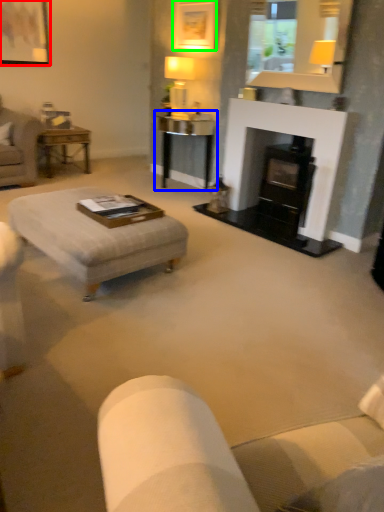
Question: Considering the real-world distances, which object is closest to picture frame (highlighted by a red box)? table (highlighted by a blue box) or picture frame (highlighted by a green box).

Choices:
 (A) table
 (B) picture frame

Answer: (B)